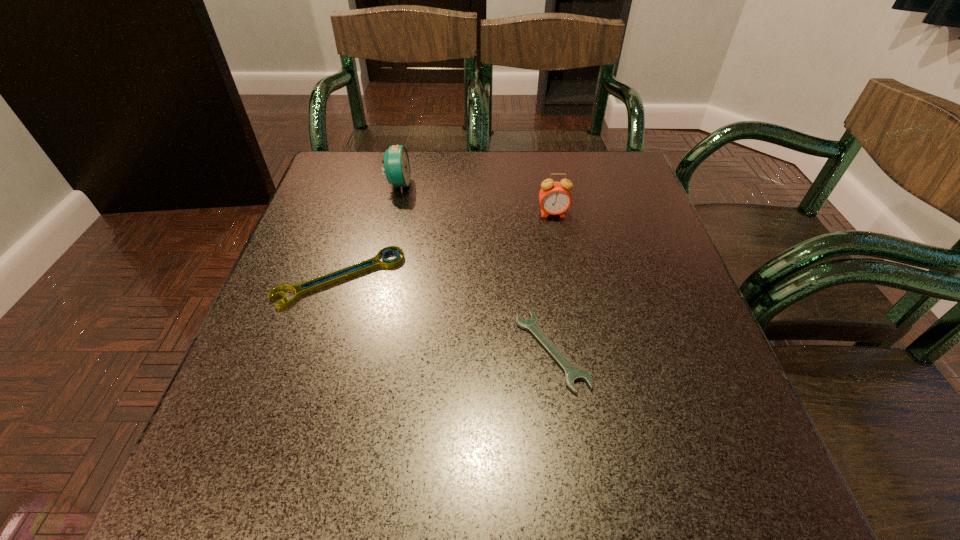
Where is `vacant region located on the front of the farther wrench`? This screenshot has height=540, width=960. vacant region located on the front of the farther wrench is located at coordinates (285, 456).

Where is `free space located on the back of the right wrench`? free space located on the back of the right wrench is located at coordinates (532, 201).

In order to click on object positioned at the far edge in this screenshot , I will do `click(396, 161)`.

Find the location of a particular element. Image resolution: width=960 pixels, height=540 pixels. object that is at the left edge is located at coordinates 342,274.

The width and height of the screenshot is (960, 540). Identify the location of free space at the far edge. click(x=547, y=169).

In the image, there is a desktop. Where is `vacant space at the near edge`? This screenshot has width=960, height=540. vacant space at the near edge is located at coordinates (428, 472).

In the image, there is a desktop. At what (x,y) coordinates should I click in order to perform the action: click on free space at the left edge. Please return your answer as a coordinate pair (x, y). The image size is (960, 540). Looking at the image, I should click on (367, 210).

In order to click on free point at the right edge in this screenshot , I will do `click(646, 261)`.

Locate an element on the screen. The image size is (960, 540). vacant space at the far left corner of the desktop is located at coordinates point(346,190).

At what (x,y) coordinates should I click in order to perform the action: click on blank space at the near left corner. Please return your answer as a coordinate pair (x, y). This screenshot has width=960, height=540. Looking at the image, I should click on (202, 502).